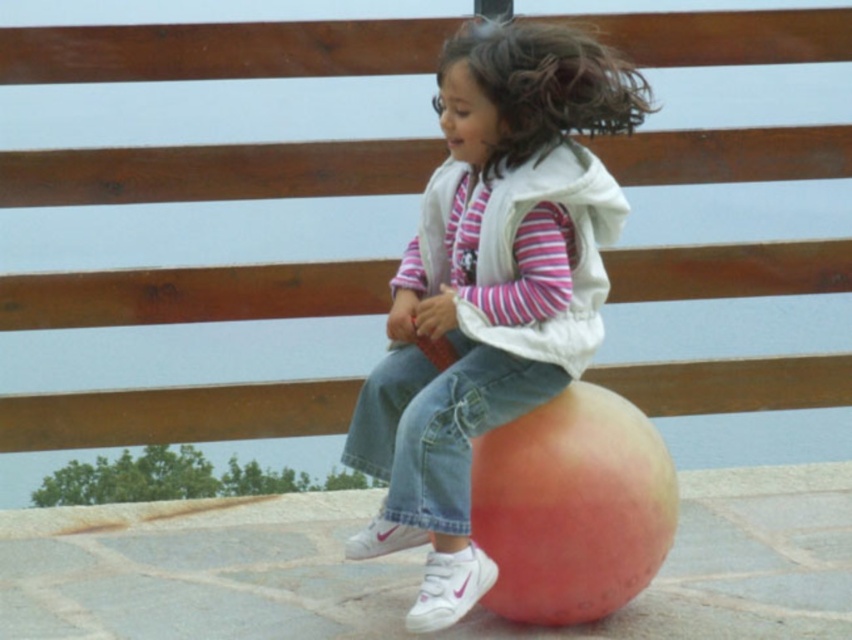
You are a photographer trying to capture the perfect shot of the pink matte ball at center. The camera is positioned at the origin point. Which direction should you move the camera to align it with the ball?

The pink matte ball at center is located at point coordinates 0.447 on the x axis and 0.576 on the y axis. Since the camera is at the origin, you should move it right along the x axis and up along the y axis to align with the ball.

You are a photographer trying to capture a candid shot of the child. You notice the jeans at center and the white fleece vest at center. Which clothing item is positioned more to the left in the image?

The jeans at center are to the left of the white fleece vest at center, so the jeans at center are positioned more to the left in the image.